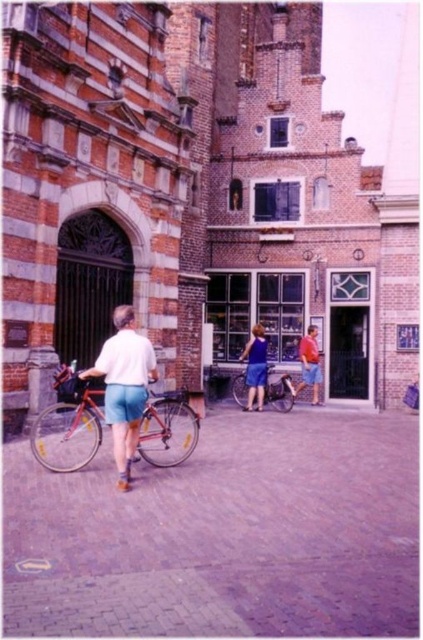
You are standing in the historic town square and want to place a small bench exactly at the point marked by the coordinates point (224, 534). According to the image, what object is currently located at that specific coordinate?

The brick pavement at center is located at point (224, 534), so the bench cannot be placed there as the spot is already occupied by the brick pavement at center.

From the picture: You are standing in the historic town square and want to take a photo of the orange fabric shirt at center without including the brick pavement at center in the frame. Is this possible based on their positions?

The brick pavement at center is closer to the viewer than the orange fabric shirt at center, so you cannot exclude the brick pavement at center from the photo as it is in front of the orange fabric shirt at center.

You are standing in the historic town square and see a brick pavement at center and a matte blue dress at center. Which object is positioned to the left?

The brick pavement at center is to the left of the matte blue dress at center.